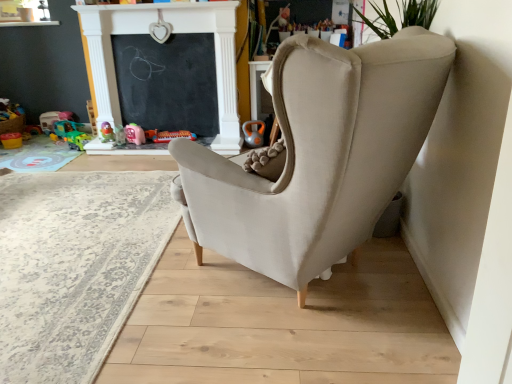
This screenshot has height=384, width=512. I want to click on blank space above beige fabric rug at lower left (from a real-world perspective), so click(67, 224).